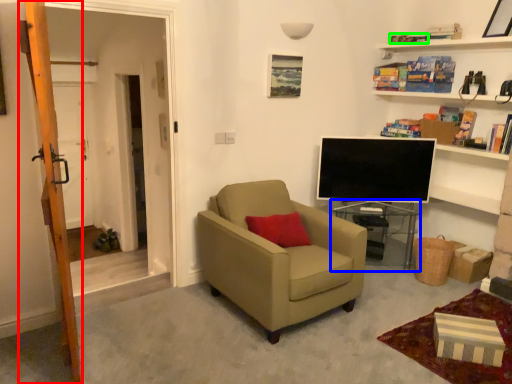
Question: Considering the real-world distances, which object is closest to ladder (highlighted by a red box)? table (highlighted by a blue box) or book (highlighted by a green box).

Choices:
 (A) table
 (B) book

Answer: (A)